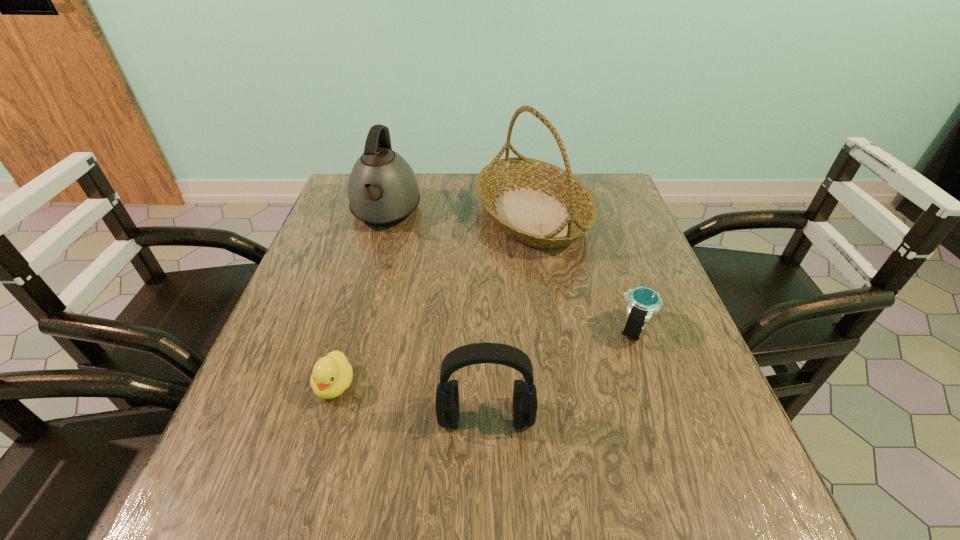
Locate an element on the screen. Image resolution: width=960 pixels, height=540 pixels. vacant space at the left edge of the desktop is located at coordinates pos(317,285).

In the image, there is a desktop. Where is `vacant space at the right edge`? Image resolution: width=960 pixels, height=540 pixels. vacant space at the right edge is located at coordinates (681, 327).

Locate an element on the screen. The image size is (960, 540). vacant space at the near left corner of the desktop is located at coordinates pyautogui.click(x=278, y=503).

What are the coordinates of `free space at the far right corner of the desktop` in the screenshot? It's located at (599, 198).

Where is `free region at the near right corner of the desktop`? This screenshot has width=960, height=540. free region at the near right corner of the desktop is located at coordinates (739, 484).

The height and width of the screenshot is (540, 960). I want to click on free point between the duckling and the headset, so click(411, 401).

In order to click on empty location between the fourth shortest object and the shortest object in this screenshot , I will do `click(360, 300)`.

Locate an element on the screen. vacant space that's between the third tallest object and the shortest object is located at coordinates (411, 401).

Where is `vacant region between the shortest object and the kettle`? vacant region between the shortest object and the kettle is located at coordinates (360, 300).

Identify the location of free space between the kettle and the duckling. The width and height of the screenshot is (960, 540). (360, 300).